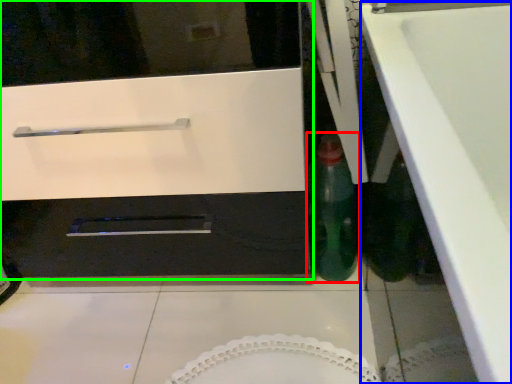
Question: Which object is the closest to the bottle (highlighted by a red box)? Choose among these: counter top (highlighted by a blue box) or oven (highlighted by a green box).

Choices:
 (A) counter top
 (B) oven

Answer: (B)